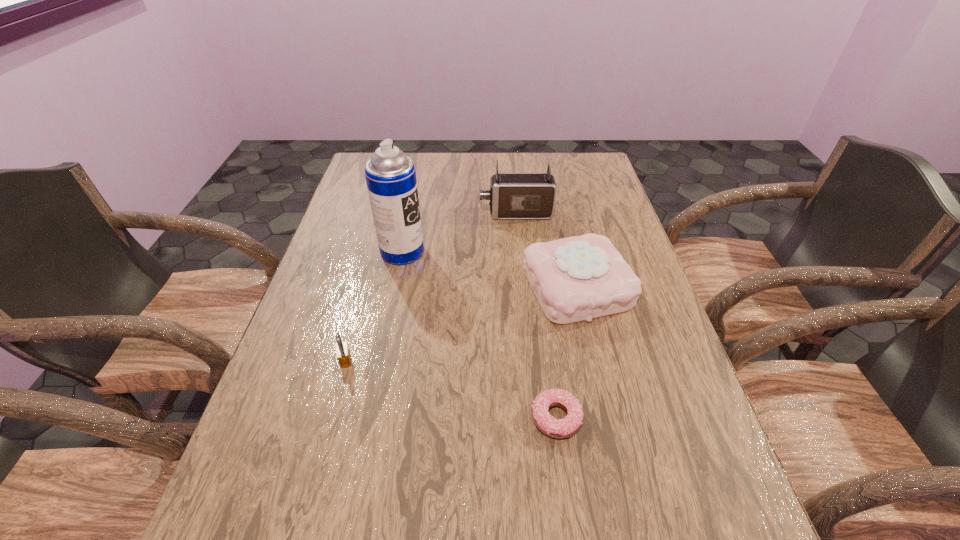
Where is `aerosol can`? The height and width of the screenshot is (540, 960). aerosol can is located at coordinates (390, 175).

The width and height of the screenshot is (960, 540). I want to click on the second object from left to right, so click(390, 175).

Locate an element on the screen. Image resolution: width=960 pixels, height=540 pixels. camcorder is located at coordinates (512, 195).

Locate an element on the screen. This screenshot has width=960, height=540. the farthest object is located at coordinates pyautogui.click(x=512, y=195).

At what (x,y) coordinates should I click in order to perform the action: click on the third tallest object. Please return your answer as a coordinate pair (x, y). This screenshot has height=540, width=960. Looking at the image, I should click on (578, 278).

The width and height of the screenshot is (960, 540). I want to click on the fourth farthest object, so click(x=343, y=354).

Image resolution: width=960 pixels, height=540 pixels. I want to click on the second shortest object, so click(343, 354).

Find the location of a particular element. This screenshot has height=540, width=960. the shortest object is located at coordinates 547,424.

You are a GUI agent. You are given a task and a screenshot of the screen. Output one action in this format:
    pyautogui.click(x=<x>, y=<y>)
    Task: Click on the doughnut
    Image resolution: width=960 pixels, height=540 pixels.
    Given the screenshot: What is the action you would take?
    pyautogui.click(x=547, y=424)

What are the coordinates of `free space located on the label side of the second object from left to right` in the screenshot? It's located at (460, 252).